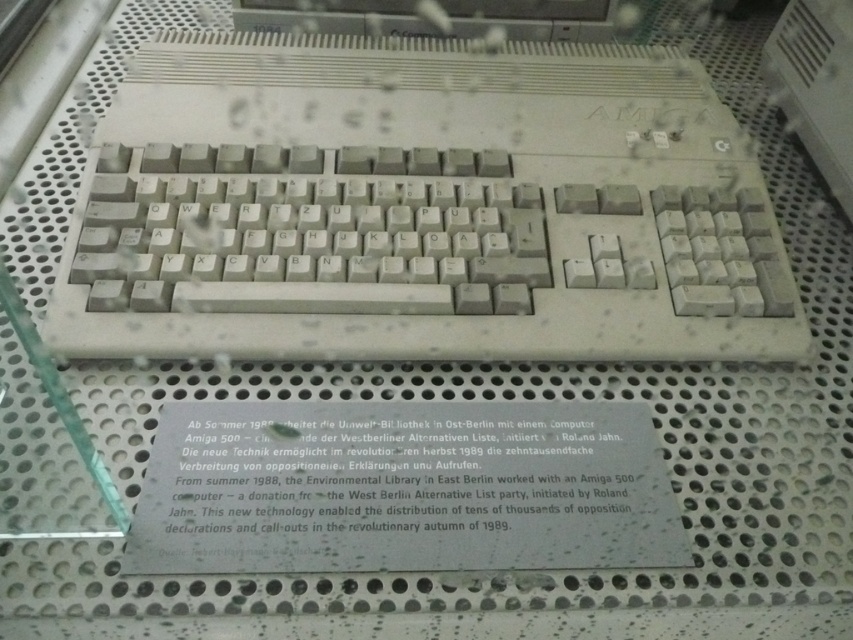
You are a museum visitor looking at the display case. You see the beige plastic keyboard at center and the white plastic keyboard at upper right. Which one is positioned higher up in the display?

The white plastic keyboard at upper right is positioned higher up in the display because it is above the beige plastic keyboard at center.

Where is the beige plastic keyboard at center located in the image?

The beige plastic keyboard at center is located at point (421, 208) in the image.